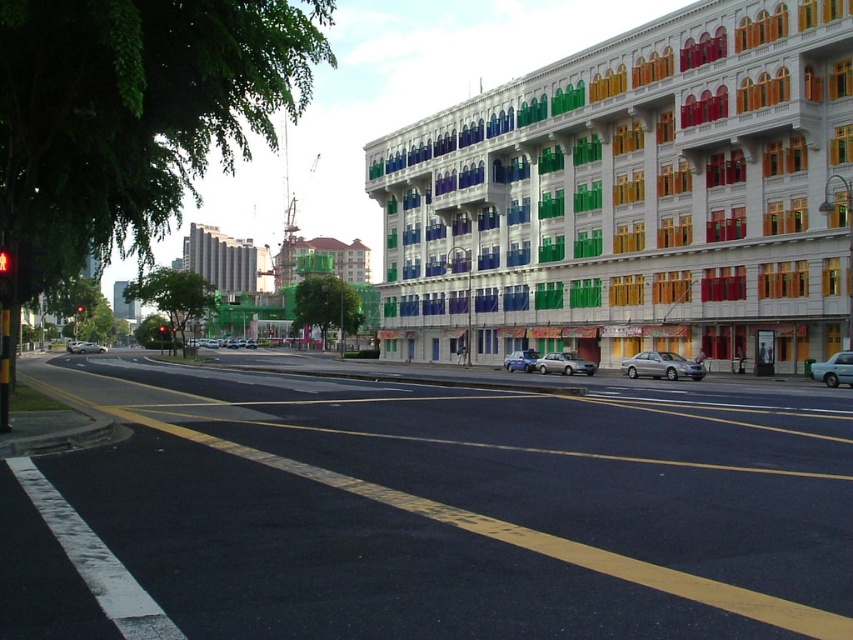
Is silver metallic sedan at center-right taller than satin silver sedan at center?

Yes, silver metallic sedan at center-right is taller than satin silver sedan at center.

Consider the image. Is silver metallic sedan at center-right closer to camera compared to satin silver sedan at center?

Yes, silver metallic sedan at center-right is in front of satin silver sedan at center.

Between point (683, 364) and point (587, 364), which one is positioned in front?

Point (683, 364)

The width and height of the screenshot is (853, 640). Find the location of `silver metallic sedan at center-right`. silver metallic sedan at center-right is located at coordinates (660, 365).

At what (x,y) coordinates should I click in order to perform the action: click on metallic silver car at right. Please return your answer as a coordinate pair (x, y). Looking at the image, I should click on (834, 369).

Who is positioned more to the left, metallic silver car at right or silver metallic sedan at center?

Positioned to the left is silver metallic sedan at center.

Who is more distant from viewer, (833, 372) or (91, 342)?

Positioned behind is point (91, 342).

The image size is (853, 640). Identify the location of metallic silver car at right. (834, 369).

Who is positioned more to the left, satin silver sedan at center or red glass traffic light at upper center?

From the viewer's perspective, red glass traffic light at upper center appears more on the left side.

Which is behind, point (556, 358) or point (160, 330)?

Point (160, 330)

Image resolution: width=853 pixels, height=640 pixels. What do you see at coordinates (563, 364) in the screenshot?
I see `satin silver sedan at center` at bounding box center [563, 364].

Identify the location of satin silver sedan at center. (563, 364).